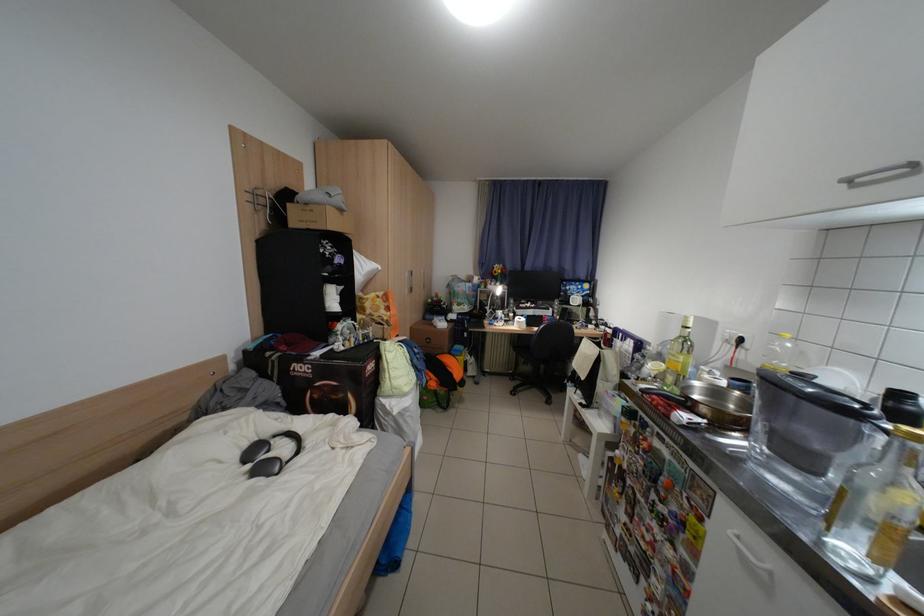
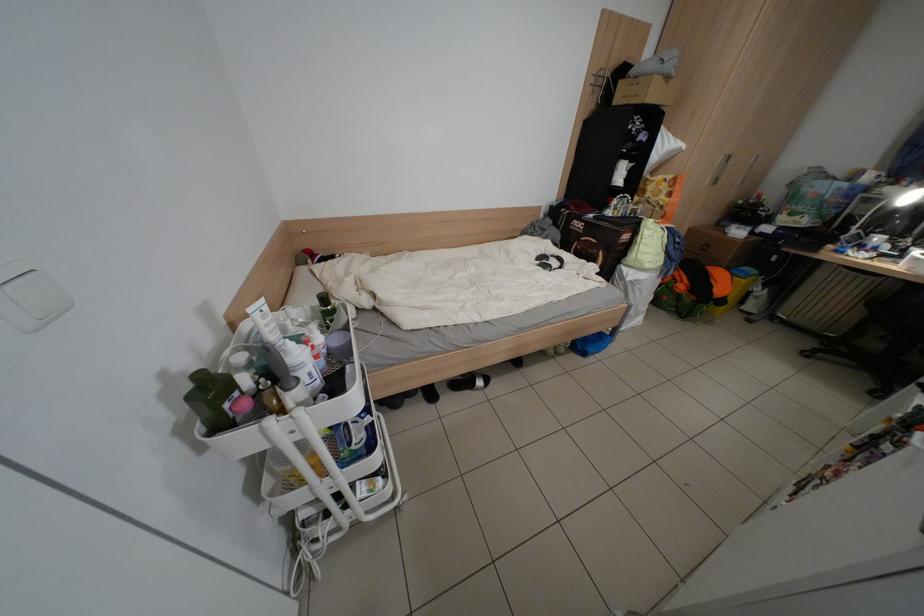
Locate, in the second image, the point that corresponds to (x=261, y=468) in the first image.

(550, 264)